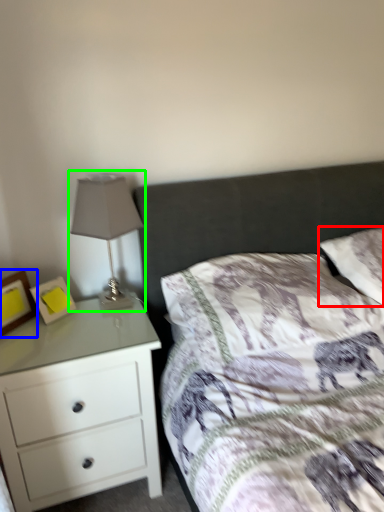
Question: Which is nearer to the pillow (highlighted by a red box)? picture frame (highlighted by a blue box) or table lamp (highlighted by a green box).

Choices:
 (A) picture frame
 (B) table lamp

Answer: (B)